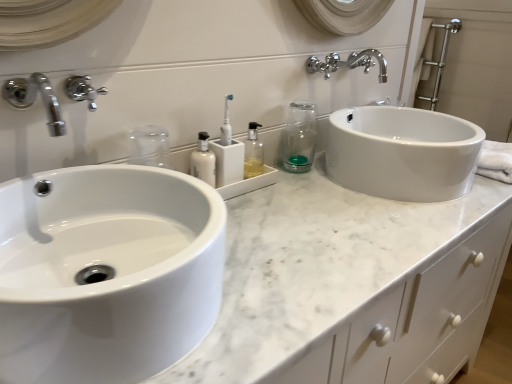
Question: Considering the relative sizes of translucent plastic bottle at center and white glossy sink at left in the image provided, is translucent plastic bottle at center bigger than white glossy sink at left?

Choices:
 (A) no
 (B) yes

Answer: (A)

Question: Is translucent plastic bottle at center wider than white glossy sink at left?

Choices:
 (A) no
 (B) yes

Answer: (A)

Question: From a real-world perspective, is translucent plastic bottle at center over white glossy sink at left?

Choices:
 (A) yes
 (B) no

Answer: (A)

Question: Would you say translucent plastic bottle at center contains white glossy sink at left?

Choices:
 (A) no
 (B) yes

Answer: (A)

Question: Can you confirm if translucent plastic bottle at center is positioned to the right of white glossy sink at left?

Choices:
 (A) no
 (B) yes

Answer: (B)

Question: Are translucent plastic bottle at center and white glossy sink at left far apart?

Choices:
 (A) no
 (B) yes

Answer: (A)

Question: Is chrome/metallic faucet at upper left, marked as the first tap in a back-to-front arrangement, facing away from white plastic toothbrush at center?

Choices:
 (A) yes
 (B) no

Answer: (B)

Question: Is chrome/metallic faucet at upper left, the 2th tap positioned from the front, bigger than white plastic toothbrush at center?

Choices:
 (A) yes
 (B) no

Answer: (A)

Question: Considering the relative positions of chrome/metallic faucet at upper left, the 2th tap positioned from the front, and white plastic toothbrush at center in the image provided, is chrome/metallic faucet at upper left, the 2th tap positioned from the front, behind white plastic toothbrush at center?

Choices:
 (A) yes
 (B) no

Answer: (B)

Question: Considering the relative positions of chrome/metallic faucet at upper left, marked as the first tap in a back-to-front arrangement, and white plastic toothbrush at center in the image provided, is chrome/metallic faucet at upper left, marked as the first tap in a back-to-front arrangement, to the right of white plastic toothbrush at center from the viewer's perspective?

Choices:
 (A) no
 (B) yes

Answer: (A)

Question: From the image's perspective, would you say chrome/metallic faucet at upper left, marked as the first tap in a back-to-front arrangement, is positioned over white plastic toothbrush at center?

Choices:
 (A) yes
 (B) no

Answer: (A)

Question: Is chrome/metallic faucet at upper left, marked as the first tap in a back-to-front arrangement, shorter than white plastic toothbrush at center?

Choices:
 (A) no
 (B) yes

Answer: (B)

Question: Is white plastic toothbrush at center a part of white marble countertop at center?

Choices:
 (A) yes
 (B) no

Answer: (B)